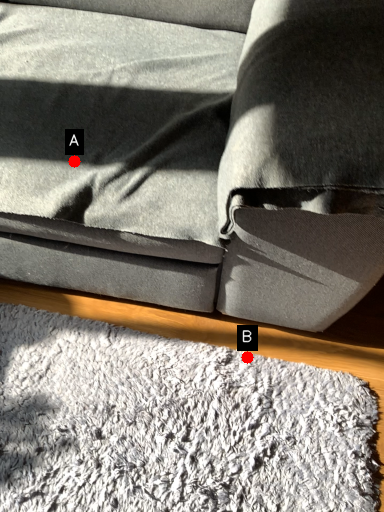
Question: Two points are circled on the image, labeled by A and B beside each circle. Among these points, which one is nearest to the camera?

Choices:
 (A) A is closer
 (B) B is closer

Answer: (A)